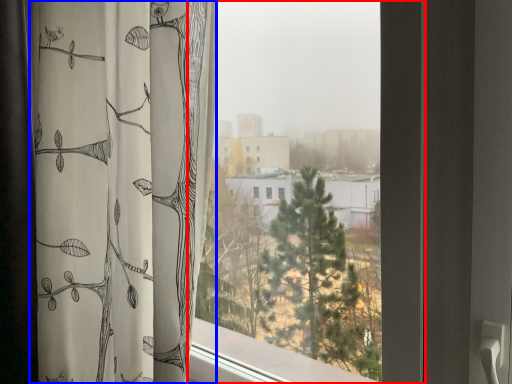
Question: Which of the following is the farthest to the observer, window (highlighted by a red box) or curtain (highlighted by a blue box)?

Choices:
 (A) window
 (B) curtain

Answer: (B)